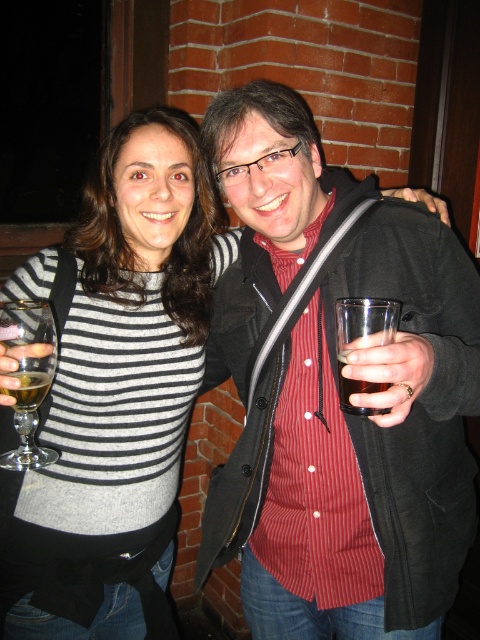
Consider the image. Can you confirm if matte black jacket at center is bigger than clear glass wine glass at lower left?

Indeed, matte black jacket at center has a larger size compared to clear glass wine glass at lower left.

Who is more forward, (x=350, y=184) or (x=32, y=372)?

Point (x=32, y=372) is in front.

Is point (251, 273) closer to viewer compared to point (55, 349)?

No.

Find the location of a particular element. matte black jacket at center is located at coordinates (336, 390).

Can you confirm if matte black jacket at center is wider than red striped shirt at center?

Yes, matte black jacket at center is wider than red striped shirt at center.

Is point (400, 364) positioned before point (348, 484)?

Yes, it is.

Between point (372, 211) and point (299, 381), which one is positioned in front?

Point (372, 211)

The image size is (480, 640). In order to click on matte black jacket at center in this screenshot , I will do `click(336, 390)`.

Between clear glass wine glass at lower left and translucent glass at left, which one is positioned higher?

clear glass wine glass at lower left is above.

The image size is (480, 640). I want to click on clear glass wine glass at lower left, so [x=28, y=378].

Who is more distant from viewer, (14, 465) or (0, 388)?

Positioned behind is point (0, 388).

Locate an element on the screen. clear glass wine glass at lower left is located at coordinates (28, 378).